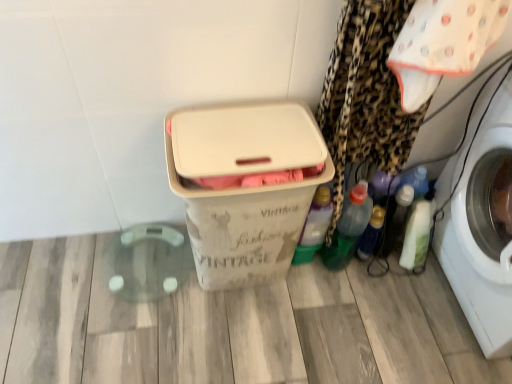
Where is `free space in front of green plastic bottle at lower right, the 3th bottle viewed from the right`? free space in front of green plastic bottle at lower right, the 3th bottle viewed from the right is located at coordinates coord(345,303).